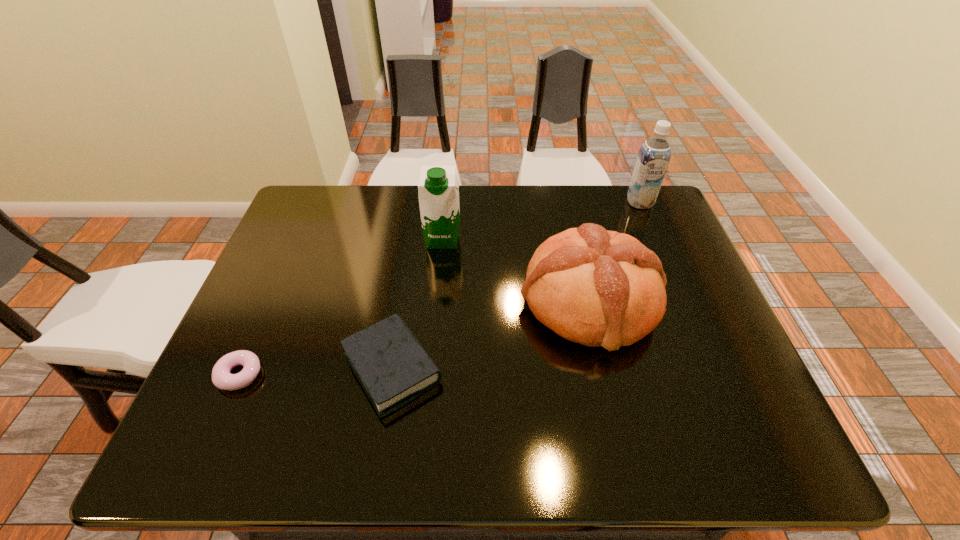
Identify the location of the farther soya milk. 654,155.

Identify the location of the rightmost object. [654, 155].

Where is `the nearer soya milk`? the nearer soya milk is located at coordinates (438, 188).

Locate an element on the screen. This screenshot has width=960, height=540. the fourth nearest object is located at coordinates (438, 188).

Identify the location of the fourth object from left to right. The width and height of the screenshot is (960, 540). (595, 287).

Identify the location of the third shortest object. This screenshot has width=960, height=540. (595, 287).

I want to click on Bible, so click(x=393, y=368).

Locate an element on the screen. This screenshot has width=960, height=540. the shortest object is located at coordinates (221, 377).

What are the coordinates of `doughnut` in the screenshot? It's located at (221, 377).

The image size is (960, 540). In order to click on free space located 0.300m on the label of the farthest object in this screenshot , I will do `click(672, 280)`.